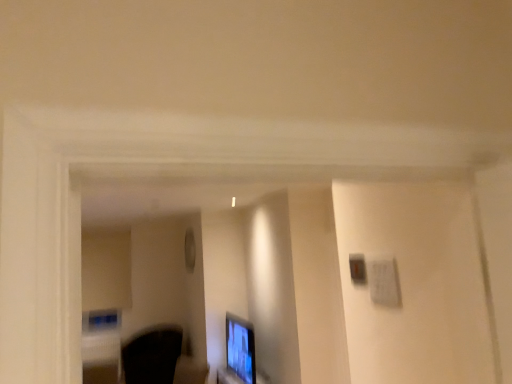
Measure the distance between black fabric swivel chair at lower left and camera.

The distance of black fabric swivel chair at lower left from camera is 5.99 meters.

I want to click on black fabric swivel chair at lower left, so click(152, 355).

Describe the element at coordinates (152, 355) in the screenshot. I see `black fabric swivel chair at lower left` at that location.

The height and width of the screenshot is (384, 512). What do you see at coordinates (240, 348) in the screenshot?
I see `matte black monitor at lower center` at bounding box center [240, 348].

Measure the distance between matte black monitor at lower center and camera.

matte black monitor at lower center is 15.92 feet away from camera.

Where is `matte black monitor at lower center`? The width and height of the screenshot is (512, 384). matte black monitor at lower center is located at coordinates (240, 348).

Where is `black fabric swivel chair at lower left`? Image resolution: width=512 pixels, height=384 pixels. black fabric swivel chair at lower left is located at coordinates (152, 355).

Considering the positions of objects black fabric swivel chair at lower left and matte black monitor at lower center in the image provided, who is more to the right, black fabric swivel chair at lower left or matte black monitor at lower center?

matte black monitor at lower center.

Is black fabric swivel chair at lower left closer to camera compared to matte black monitor at lower center?

No, black fabric swivel chair at lower left is behind matte black monitor at lower center.

Which is in front, point (160, 362) or point (229, 344)?

Point (229, 344)

Consider the image. From the image's perspective, is black fabric swivel chair at lower left located above matte black monitor at lower center?

Incorrect, from the image's perspective, black fabric swivel chair at lower left is lower than matte black monitor at lower center.

From a real-world perspective, does black fabric swivel chair at lower left sit lower than matte black monitor at lower center?

Correct, in the physical world, black fabric swivel chair at lower left is lower than matte black monitor at lower center.

In terms of width, does black fabric swivel chair at lower left look wider or thinner when compared to matte black monitor at lower center?

In the image, black fabric swivel chair at lower left appears to be wider than matte black monitor at lower center.

Considering the relative sizes of black fabric swivel chair at lower left and matte black monitor at lower center in the image provided, is black fabric swivel chair at lower left taller than matte black monitor at lower center?

No, black fabric swivel chair at lower left is not taller than matte black monitor at lower center.

Considering the sizes of objects black fabric swivel chair at lower left and matte black monitor at lower center in the image provided, who is bigger, black fabric swivel chair at lower left or matte black monitor at lower center?

Bigger between the two is black fabric swivel chair at lower left.

Would you say matte black monitor at lower center is part of black fabric swivel chair at lower left's contents?

No, matte black monitor at lower center is located outside of black fabric swivel chair at lower left.

Is the surface of black fabric swivel chair at lower left in direct contact with matte black monitor at lower center?

black fabric swivel chair at lower left and matte black monitor at lower center are clearly separated.

Is black fabric swivel chair at lower left turned away from matte black monitor at lower center?

black fabric swivel chair at lower left is not turned away from matte black monitor at lower center.

Can you tell me how much black fabric swivel chair at lower left and matte black monitor at lower center differ in facing direction?

They differ by 49.5 degrees in their facing directions.

Measure the distance from black fabric swivel chair at lower left to matte black monitor at lower center.

black fabric swivel chair at lower left and matte black monitor at lower center are 1.54 meters apart.

What are the coordinates of `swivel chair located behind the matte black monitor at lower center` in the screenshot? It's located at (152, 355).

Based on the photo, considering the positions of objects matte black monitor at lower center and black fabric swivel chair at lower left in the image provided, who is more to the left, matte black monitor at lower center or black fabric swivel chair at lower left?

Positioned to the left is black fabric swivel chair at lower left.

Which object is closer to the camera, matte black monitor at lower center or black fabric swivel chair at lower left?

matte black monitor at lower center is more forward.

Is point (252, 366) more distant than point (124, 373)?

No, (252, 366) is in front of (124, 373).

From the image's perspective, would you say matte black monitor at lower center is shown under black fabric swivel chair at lower left?

Incorrect, from the image's perspective, matte black monitor at lower center is higher than black fabric swivel chair at lower left.

From a real-world perspective, is matte black monitor at lower center beneath black fabric swivel chair at lower left?

No, from a real-world perspective, matte black monitor at lower center is not beneath black fabric swivel chair at lower left.

Considering the relative sizes of matte black monitor at lower center and black fabric swivel chair at lower left in the image provided, is matte black monitor at lower center wider than black fabric swivel chair at lower left?

No, matte black monitor at lower center is not wider than black fabric swivel chair at lower left.

Can you confirm if matte black monitor at lower center is taller than black fabric swivel chair at lower left?

Correct, matte black monitor at lower center is much taller as black fabric swivel chair at lower left.

In terms of size, does matte black monitor at lower center appear bigger or smaller than black fabric swivel chair at lower left?

matte black monitor at lower center is smaller than black fabric swivel chair at lower left.

Do you think matte black monitor at lower center is within black fabric swivel chair at lower left, or outside of it?

matte black monitor at lower center is located beyond the bounds of black fabric swivel chair at lower left.

Would you say matte black monitor at lower center is a long distance from black fabric swivel chair at lower left?

Absolutely, matte black monitor at lower center is distant from black fabric swivel chair at lower left.

Could you tell me if matte black monitor at lower center is facing black fabric swivel chair at lower left?

No, matte black monitor at lower center does not turn towards black fabric swivel chair at lower left.

What's the angular difference between matte black monitor at lower center and black fabric swivel chair at lower left's facing directions?

The facing directions of matte black monitor at lower center and black fabric swivel chair at lower left are 49.5 degrees apart.

Identify the location of computer monitor on the right of the black fabric swivel chair at lower left. The image size is (512, 384). (240, 348).

You are a GUI agent. You are given a task and a screenshot of the screen. Output one action in this format:
    pyautogui.click(x=<x>, y=<y>)
    Task: Click on the swivel chair that appears behind the matte black monitor at lower center
    
    Given the screenshot: What is the action you would take?
    pyautogui.click(x=152, y=355)

Where is `swivel chair below the matte black monitor at lower center (from the image's perspective)`? This screenshot has height=384, width=512. swivel chair below the matte black monitor at lower center (from the image's perspective) is located at coordinates (152, 355).